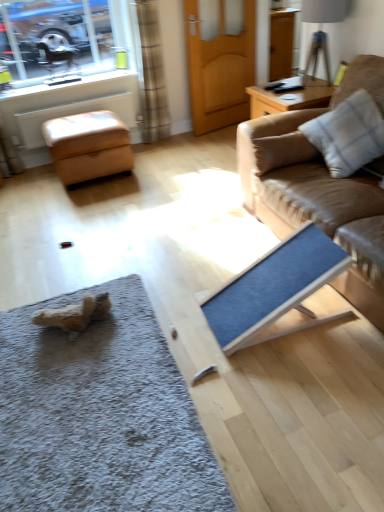
Find the location of a particular element. Image resolution: width=384 pixels, height=512 pixels. vacant space underneath matte brown armchair at upper left (from a real-world perspective) is located at coordinates (72, 77).